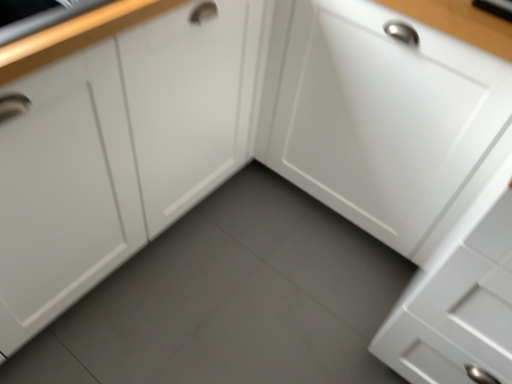
Question: Is white matte cabinet at center, the second cabinetry in the right-to-left sequence, closer to camera compared to white matte cabinet door at center, the 2th cabinetry from the left?

Choices:
 (A) no
 (B) yes

Answer: (B)

Question: Considering the relative positions of white matte cabinet at center, acting as the first cabinetry starting from the left, and white matte cabinet door at center, the 2th cabinetry from the left, in the image provided, is white matte cabinet at center, acting as the first cabinetry starting from the left, to the right of white matte cabinet door at center, the 2th cabinetry from the left, from the viewer's perspective?

Choices:
 (A) yes
 (B) no

Answer: (B)

Question: From a real-world perspective, is white matte cabinet at center, acting as the first cabinetry starting from the left, positioned under white matte cabinet door at center, positioned as the first cabinetry in right-to-left order, based on gravity?

Choices:
 (A) no
 (B) yes

Answer: (A)

Question: Can you confirm if white matte cabinet at center, acting as the first cabinetry starting from the left, is bigger than white matte cabinet door at center, positioned as the first cabinetry in right-to-left order?

Choices:
 (A) yes
 (B) no

Answer: (A)

Question: Are white matte cabinet at center, the second cabinetry in the right-to-left sequence, and white matte cabinet door at center, positioned as the first cabinetry in right-to-left order, making contact?

Choices:
 (A) yes
 (B) no

Answer: (B)

Question: Is white matte cabinet at center, acting as the first cabinetry starting from the left, thinner than white matte cabinet door at center, the 2th cabinetry from the left?

Choices:
 (A) no
 (B) yes

Answer: (A)

Question: Is white matte cabinet door at center, positioned as the first cabinetry in right-to-left order, further to camera compared to white matte cabinet at center, the second cabinetry in the right-to-left sequence?

Choices:
 (A) no
 (B) yes

Answer: (B)

Question: From a real-world perspective, is white matte cabinet door at center, positioned as the first cabinetry in right-to-left order, on top of white matte cabinet at center, acting as the first cabinetry starting from the left?

Choices:
 (A) yes
 (B) no

Answer: (B)

Question: Does white matte cabinet door at center, positioned as the first cabinetry in right-to-left order, touch white matte cabinet at center, acting as the first cabinetry starting from the left?

Choices:
 (A) no
 (B) yes

Answer: (A)

Question: Is white matte cabinet door at center, the 2th cabinetry from the left, to the left of white matte cabinet at center, the second cabinetry in the right-to-left sequence, from the viewer's perspective?

Choices:
 (A) no
 (B) yes

Answer: (A)

Question: Can you confirm if white matte cabinet door at center, the 2th cabinetry from the left, is shorter than white matte cabinet at center, acting as the first cabinetry starting from the left?

Choices:
 (A) yes
 (B) no

Answer: (B)

Question: Is white matte cabinet door at center, the 2th cabinetry from the left, not near white matte cabinet at center, acting as the first cabinetry starting from the left?

Choices:
 (A) yes
 (B) no

Answer: (B)

Question: Considering the positions of white matte cabinet door at center, positioned as the first cabinetry in right-to-left order, and white matte cabinet at center, acting as the first cabinetry starting from the left, in the image, is white matte cabinet door at center, positioned as the first cabinetry in right-to-left order, wider or thinner than white matte cabinet at center, acting as the first cabinetry starting from the left,?

Choices:
 (A) thin
 (B) wide

Answer: (A)